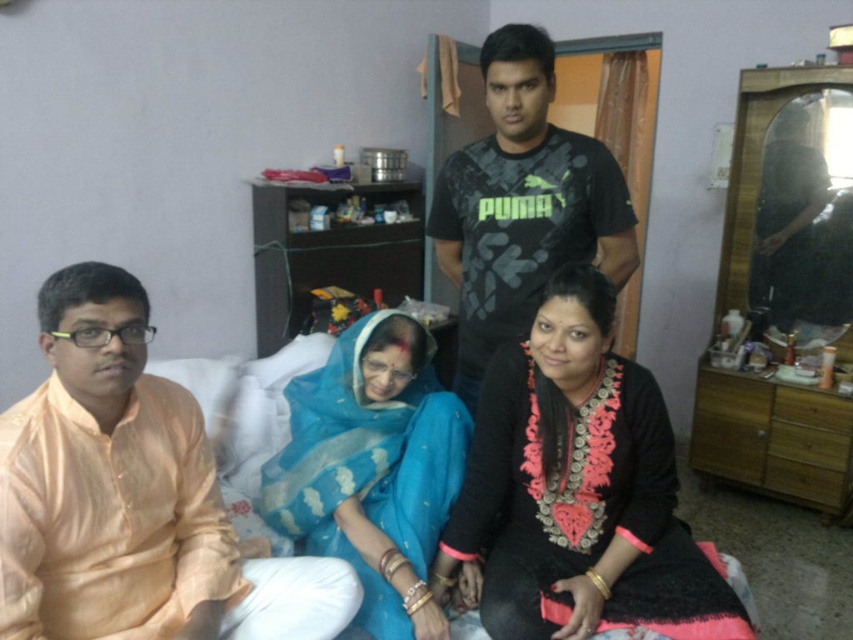
Based on the photo, who is more forward, (341, 408) or (552, 131)?

Point (341, 408) is more forward.

Can you confirm if blue silk saree at center is taller than black matte t-shirt at center?

No.

Is point (312, 400) farther from viewer compared to point (589, 188)?

Yes, point (312, 400) is farther from viewer.

At what (x,y) coordinates should I click in order to perform the action: click on blue silk saree at center. Please return your answer as a coordinate pair (x, y). Image resolution: width=853 pixels, height=640 pixels. Looking at the image, I should click on (373, 468).

Looking at this image, does black lace dress at center have a smaller size compared to blue silk saree at center?

No, black lace dress at center is not smaller than blue silk saree at center.

Find the location of a particular element. The image size is (853, 640). black lace dress at center is located at coordinates (578, 490).

What are the coordinates of `black lace dress at center` in the screenshot? It's located at (578, 490).

Is light peach silk kurta at lower left to the right of black matte t-shirt at center from the viewer's perspective?

In fact, light peach silk kurta at lower left is to the left of black matte t-shirt at center.

Is the position of light peach silk kurta at lower left more distant than that of black matte t-shirt at center?

No, it is not.

Find the location of a particular element. light peach silk kurta at lower left is located at coordinates (131, 497).